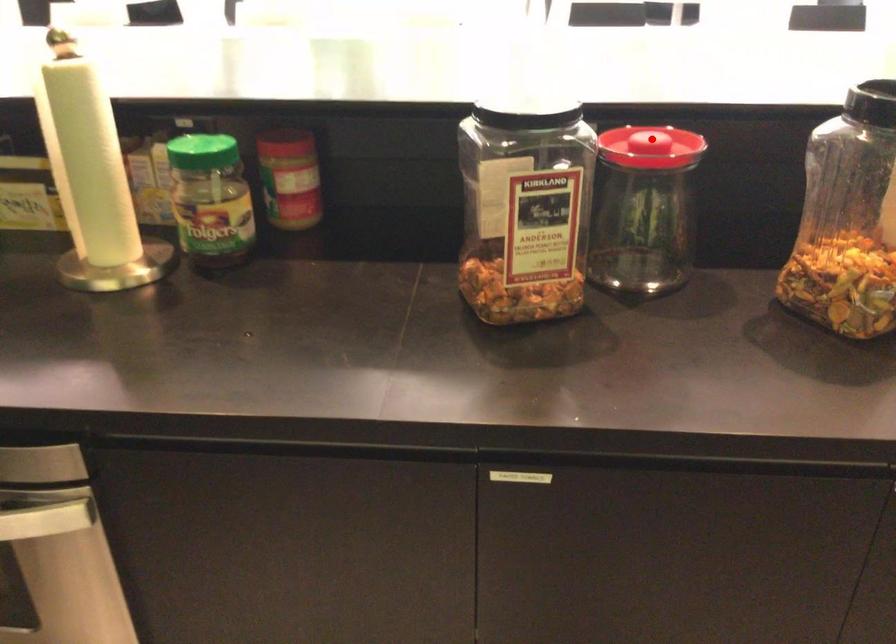
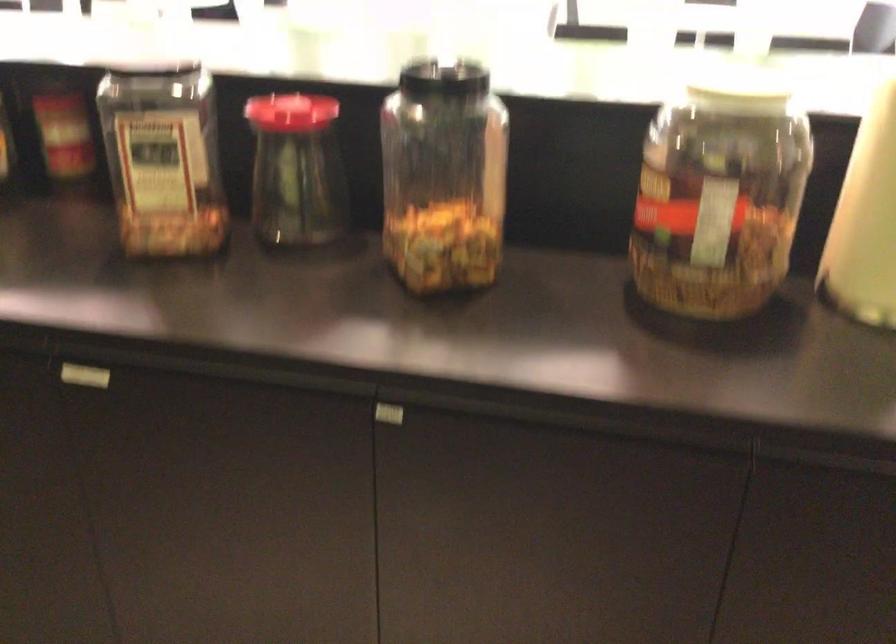
The point at the highlighted location is marked in the first image. Where is the corresponding point in the second image?

(290, 111)